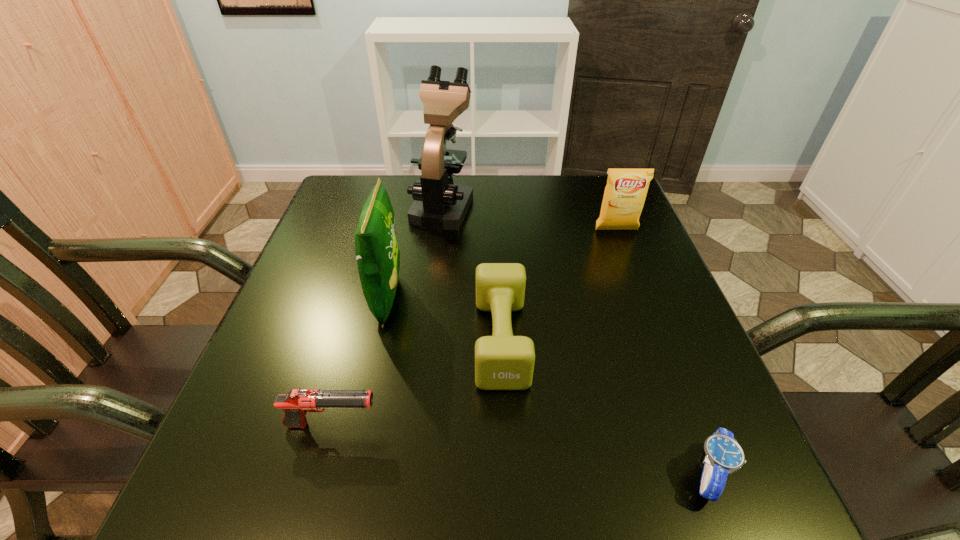
Locate an element on the screen. free point located 0.290m on the front-facing side of the second tallest object is located at coordinates (542, 298).

Find the location of a particular element. This screenshot has height=540, width=960. free space located 0.350m on the front of the right crisp (potato chip) with the logo is located at coordinates (661, 346).

This screenshot has width=960, height=540. What are the coordinates of `free region located 0.050m on the left of the dumbbell` in the screenshot? It's located at (449, 340).

The image size is (960, 540). Find the location of `vacant area located 0.280m at the aiming end of the gun`. vacant area located 0.280m at the aiming end of the gun is located at coordinates (555, 425).

The image size is (960, 540). Identify the location of free point located 0.250m on the back of the shortest object. (651, 321).

Locate an element on the screen. object positioned at the far edge is located at coordinates click(439, 203).

The height and width of the screenshot is (540, 960). I want to click on object situated at the near edge, so click(x=724, y=455).

Where is `object that is at the left edge`? Image resolution: width=960 pixels, height=540 pixels. object that is at the left edge is located at coordinates (295, 404).

Where is `crisp (potato chip) situated at the right edge`? The width and height of the screenshot is (960, 540). crisp (potato chip) situated at the right edge is located at coordinates (625, 193).

What are the coordinates of `watch that is at the right edge` in the screenshot? It's located at (724, 455).